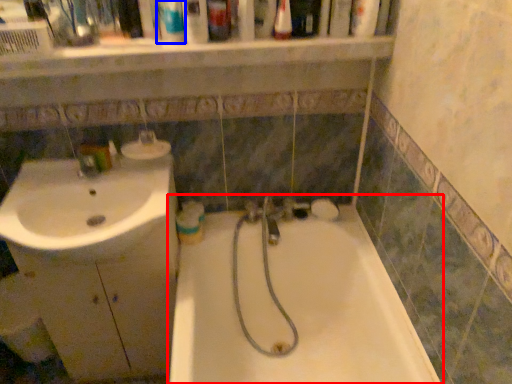
Question: Which object is further to the camera taking this photo, bathtub (highlighted by a red box) or mouthwash (highlighted by a blue box)?

Choices:
 (A) bathtub
 (B) mouthwash

Answer: (B)